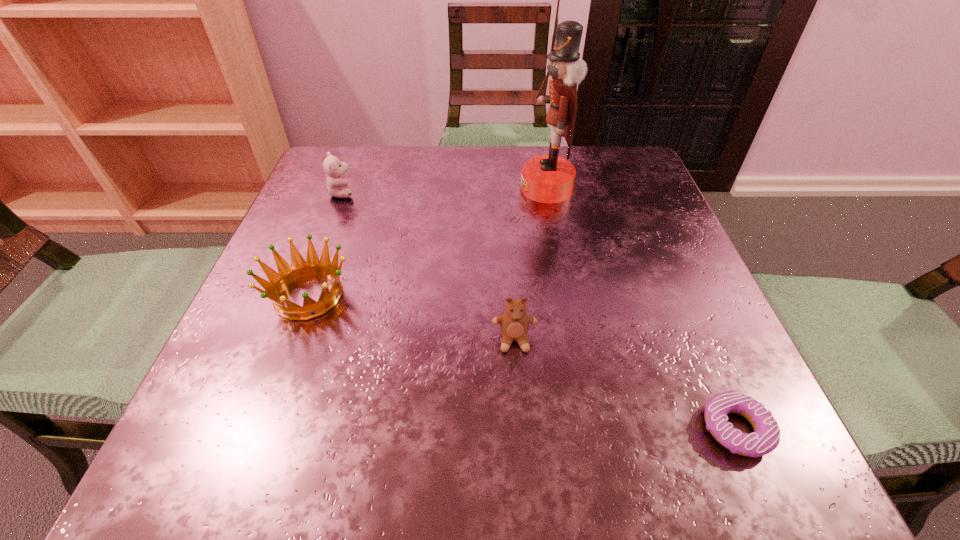
Locate an element on the screen. Image resolution: width=960 pixels, height=540 pixels. nutcracker is located at coordinates (550, 178).

Where is `the second object from right to left`? The height and width of the screenshot is (540, 960). the second object from right to left is located at coordinates (550, 178).

Locate an element on the screen. This screenshot has width=960, height=540. the farther teddy bear is located at coordinates (335, 170).

Where is `the nearer teddy bear`? The width and height of the screenshot is (960, 540). the nearer teddy bear is located at coordinates [514, 324].

I want to click on the third object from right to left, so click(x=514, y=324).

The height and width of the screenshot is (540, 960). What are the coordinates of `crown` in the screenshot? It's located at (287, 274).

Locate an element on the screen. The width and height of the screenshot is (960, 540). the rightmost object is located at coordinates click(766, 436).

Where is `the shortest object`? The width and height of the screenshot is (960, 540). the shortest object is located at coordinates (766, 436).

The width and height of the screenshot is (960, 540). What are the coordinates of `vacant space located 0.350m on the front-facing side of the second object from right to left` in the screenshot? It's located at (358, 188).

Identify the location of vacant position located 0.220m on the front-facing side of the second object from right to left. (419, 188).